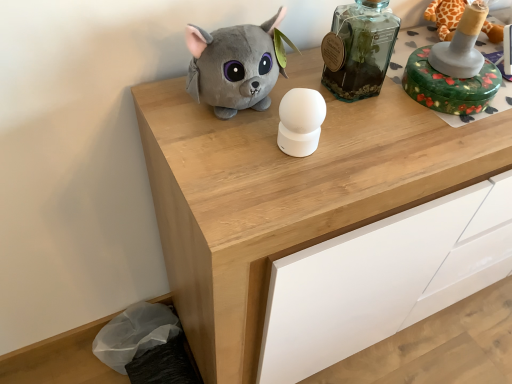
Question: From a real-world perspective, relative to transparent glass bottle at upper center, is wooden chest of drawers at center vertically above or below?

Choices:
 (A) below
 (B) above

Answer: (A)

Question: In terms of height, does wooden chest of drawers at center look taller or shorter compared to transparent glass bottle at upper center?

Choices:
 (A) tall
 (B) short

Answer: (A)

Question: Which is nearer to the transparent glass bottle at upper center?

Choices:
 (A) wooden chest of drawers at center
 (B) green floral-patterned box at upper right, which is counted as the second toy, starting from the left
 (C) soft plush cat at upper center, which is the 1th toy in left-to-right order

Answer: (B)

Question: Considering the real-world distances, which object is farthest from the transparent glass bottle at upper center?

Choices:
 (A) green floral-patterned box at upper right, which is counted as the second toy, starting from the left
 (B) soft plush cat at upper center, which is the 1th toy in left-to-right order
 (C) wooden chest of drawers at center

Answer: (B)